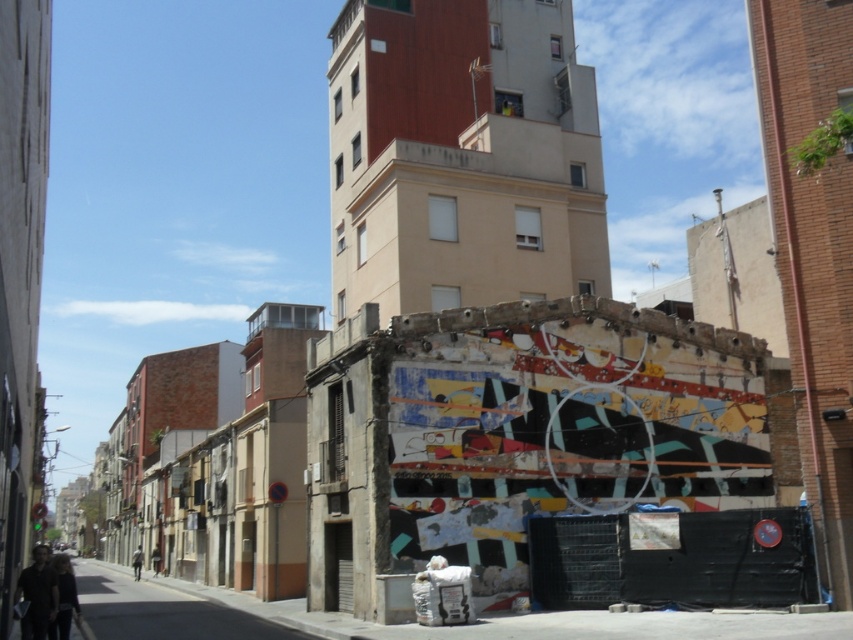
You are a pedestrian standing at the dark gray fabric jacket at lower left position. You want to walk to the smooth concrete building at upper center. Which direction should you head towards?

The smooth concrete building at upper center is to the right of the dark gray fabric jacket at lower left, so you should head towards the right direction.

You are a city planner assessing the urban space. You notice the smooth concrete building at upper center and the dark gray fabric jacket at lower left. Which object is more likely to occupy a larger horizontal space in the scene?

The smooth concrete building at upper center is wider than the dark gray fabric jacket at lower left, so it occupies a larger horizontal space in the scene.

You are a photographer trying to capture both the smooth concrete building at upper center and the dark gray fabric jacket at lower left in the same frame. Considering their sizes, which object should you focus on to ensure both are visible clearly?

The smooth concrete building at upper center is larger than the dark gray fabric jacket at lower left. To ensure both are visible clearly in the frame, focus on the smooth concrete building at upper center first, then adjust the camera to include the smaller dark gray fabric jacket at lower left.